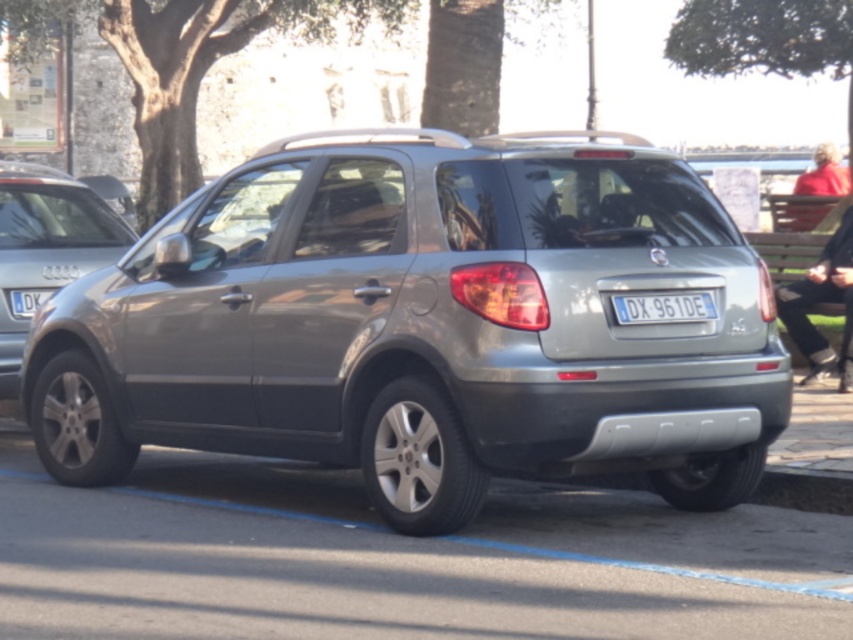
Is point (79, 253) closer to viewer compared to point (804, 333)?

Yes, it is in front of point (804, 333).

Which is below, satin silver suv at left or red sweater at right?

Positioned lower is red sweater at right.

The height and width of the screenshot is (640, 853). Describe the element at coordinates (50, 243) in the screenshot. I see `satin silver suv at left` at that location.

Where is `satin silver suv at left`? Image resolution: width=853 pixels, height=640 pixels. satin silver suv at left is located at coordinates (50, 243).

Is point (625, 323) less distant than point (16, 296)?

Yes, point (625, 323) is closer to viewer.

Between white plastic license plate at center and blue metallic license plate at lower left, which one is positioned lower?

Positioned lower is white plastic license plate at center.

Where is `white plastic license plate at center`? white plastic license plate at center is located at coordinates (663, 307).

Is gray asphalt at lower center behind white plastic license plate at center?

No.

Is point (210, 483) less distant than point (700, 307)?

No.

Is point (699, 547) positioned in front of point (662, 304)?

That is True.

In order to click on gray asphalt at lower center in this screenshot , I will do `click(395, 560)`.